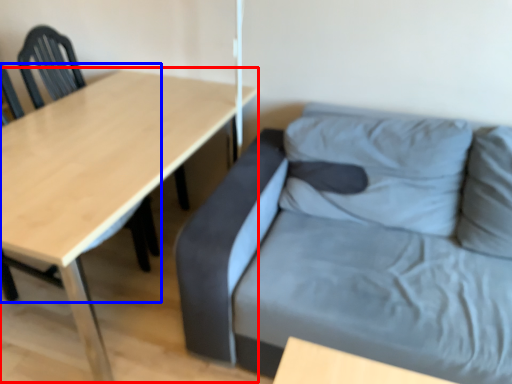
Question: Which object is further to the camera taking this photo, table (highlighted by a red box) or chair (highlighted by a blue box)?

Choices:
 (A) table
 (B) chair

Answer: (B)